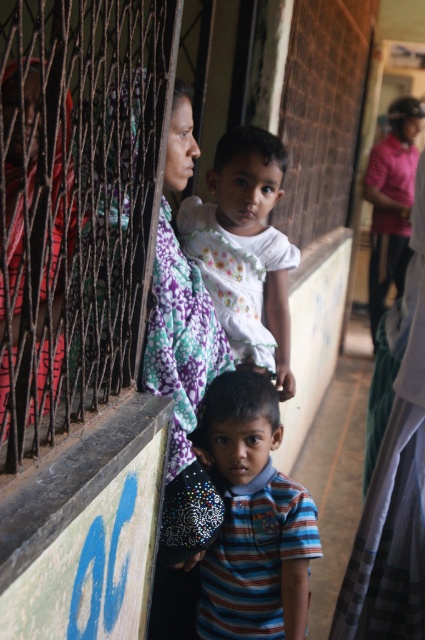
You are a photographer trying to capture both the striped cotton shirt at center and the white matte dress at center in a single frame. Given that the camera can only focus on objects within a 1.2 meter height range, can both be included without adjusting the camera angle?

The striped cotton shirt at center is smaller than the white matte dress at center, but the exact height difference isn

You are standing in the scene depicted in the image. There is a striped cotton shirt at center. Where exactly is the striped cotton shirt located in terms of coordinates?

The striped cotton shirt at center is located at coordinates point [252,518].

You are standing at the point with coordinates point (272, 280) and want to walk to the point with coordinates point (229, 545). Which direction should you move to reach your destination?

You should move forward because point (229, 545) is in front of point (272, 280).